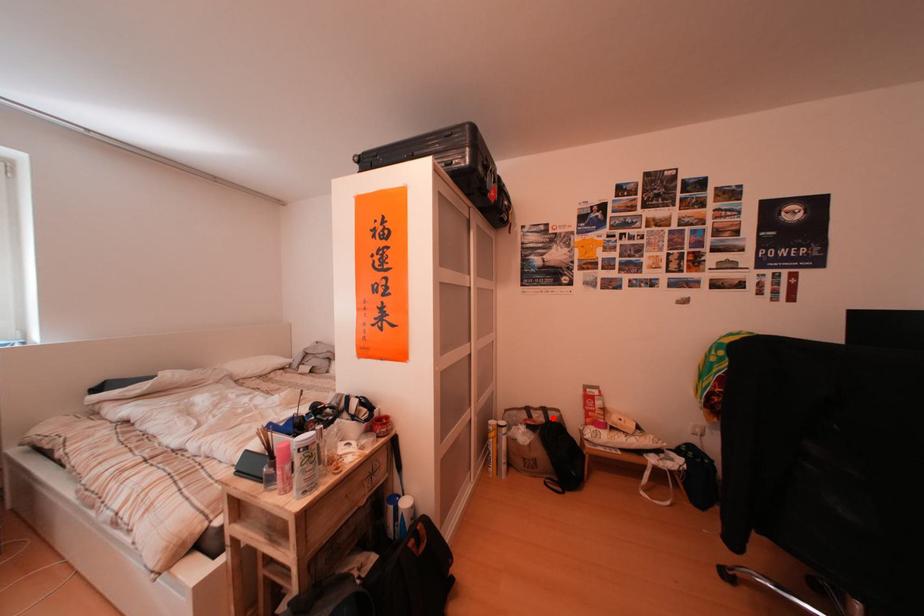
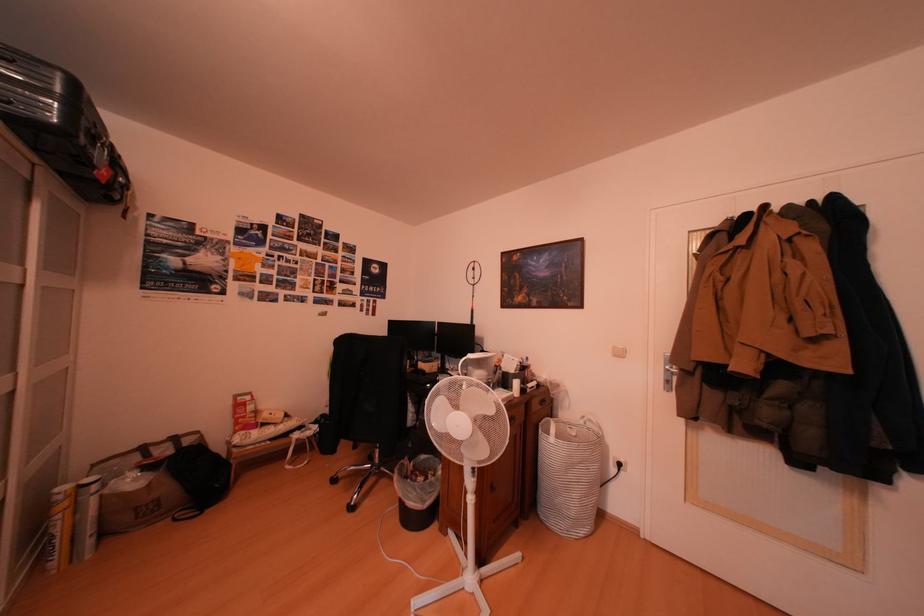
Question: I am providing you with two images of the same scene from different viewpoints. In image1, a red point is highlighted. Considering the same 3D point in image2, which of the following is correct?

Choices:
 (A) It is closer
 (B) It is farther

Answer: (A)